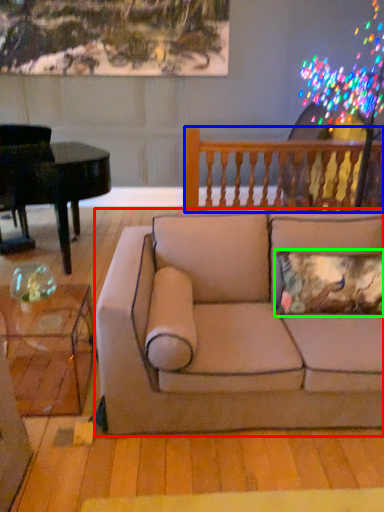
Question: Based on their relative distances, which object is nearer to studio couch (highlighted by a red box)? Choose from rail (highlighted by a blue box) and pillow (highlighted by a green box).

Choices:
 (A) rail
 (B) pillow

Answer: (B)